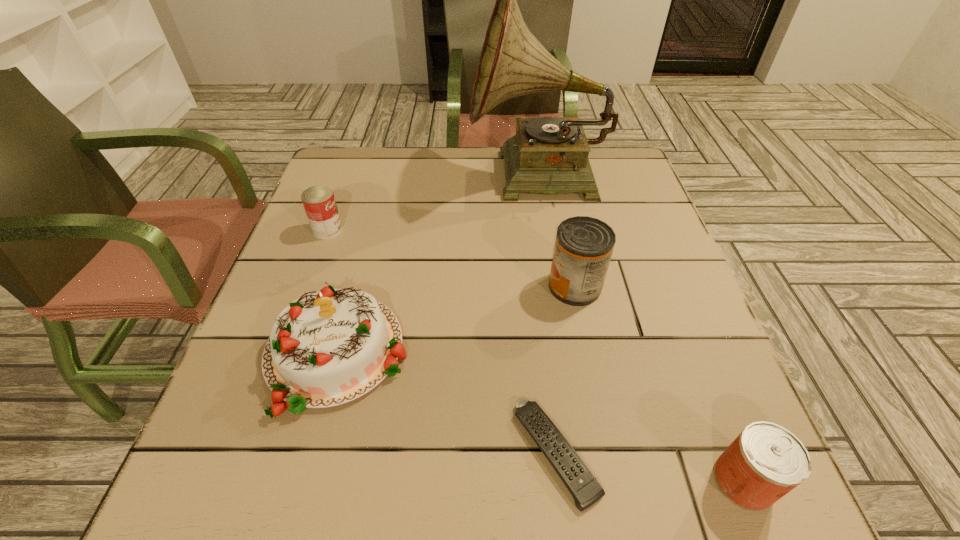
Locate an element on the screen. This screenshot has height=540, width=960. vacant space situated from the horn of the farthest object is located at coordinates (372, 178).

Find the location of a particular element. The image size is (960, 540). vacant area situated 0.260m from the horn of the farthest object is located at coordinates (375, 178).

Where is `free spot located from the horn of the farthest object`? This screenshot has height=540, width=960. free spot located from the horn of the farthest object is located at coordinates (379, 178).

Where is `vacant space located 0.390m on the back of the second farthest can`? The width and height of the screenshot is (960, 540). vacant space located 0.390m on the back of the second farthest can is located at coordinates (551, 170).

The width and height of the screenshot is (960, 540). I want to click on vacant space located on the back of the cake, so click(364, 252).

Locate an element on the screen. The image size is (960, 540). vacant region located on the front label of the farthest can is located at coordinates (439, 230).

Locate an element on the screen. This screenshot has width=960, height=540. vacant space located on the left of the rightmost can is located at coordinates (607, 481).

You are a GUI agent. You are given a task and a screenshot of the screen. Output one action in this format:
    pyautogui.click(x=<x>, y=<y>)
    Task: Click on the vacant area located 0.380m on the left of the remote control
    Image resolution: width=960 pixels, height=540 pixels.
    Given the screenshot: What is the action you would take?
    pos(271,453)

This screenshot has width=960, height=540. I want to click on object that is at the far edge, so click(549, 155).

Locate an element on the screen. can located at the near edge is located at coordinates (766, 461).